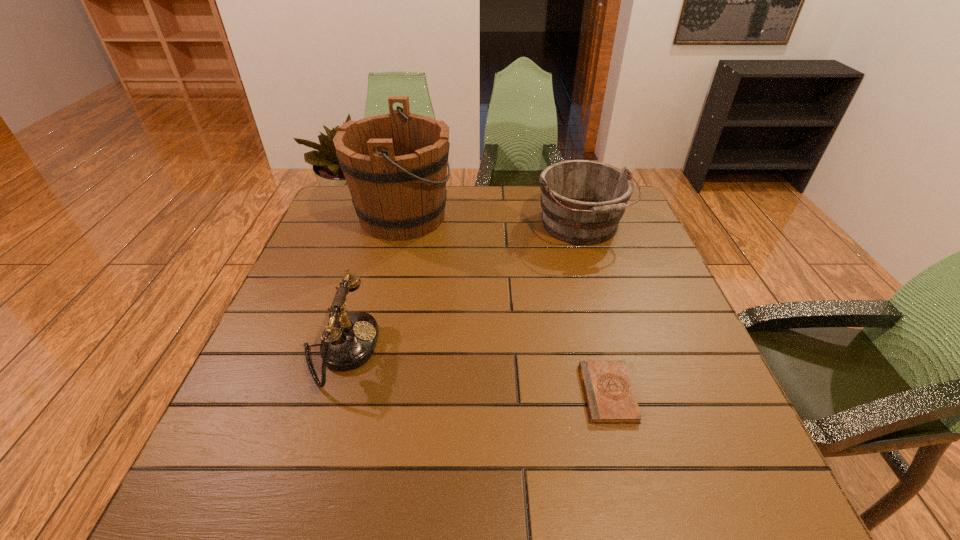
The width and height of the screenshot is (960, 540). Find the location of `the left wine bucket`. the left wine bucket is located at coordinates (395, 165).

Locate an element on the screen. the taller wine bucket is located at coordinates (395, 165).

Where is `the right wine bucket`? This screenshot has width=960, height=540. the right wine bucket is located at coordinates (582, 201).

Identify the location of telephone. The height and width of the screenshot is (540, 960). [349, 339].

Where is `diary`? diary is located at coordinates (610, 398).

The height and width of the screenshot is (540, 960). What are the coordinates of `vacant space located on the side of the taller wine bucket with the handle for carrying` in the screenshot? It's located at (548, 216).

Identify the location of vacant area situated 0.050m on the front of the shorter wine bucket. (593, 267).

Find the location of a particular element. free space located on the dial of the telephone is located at coordinates (489, 349).

This screenshot has height=540, width=960. Identify the location of free space located 0.190m on the spine side of the diary. (487, 393).

This screenshot has width=960, height=540. I want to click on free location located on the spine side of the diary, so click(x=487, y=393).